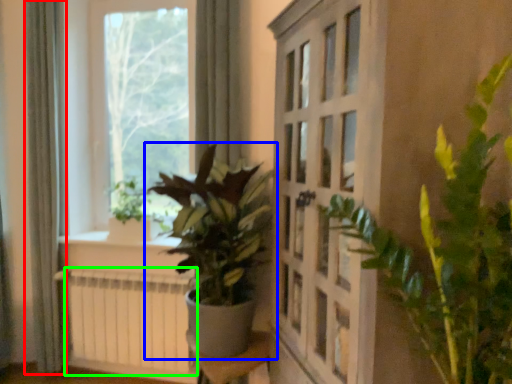
Question: Based on their relative distances, which object is farther from curtain (highlighted by a red box)? Choose from houseplant (highlighted by a blue box) and radiator (highlighted by a green box).

Choices:
 (A) houseplant
 (B) radiator

Answer: (A)